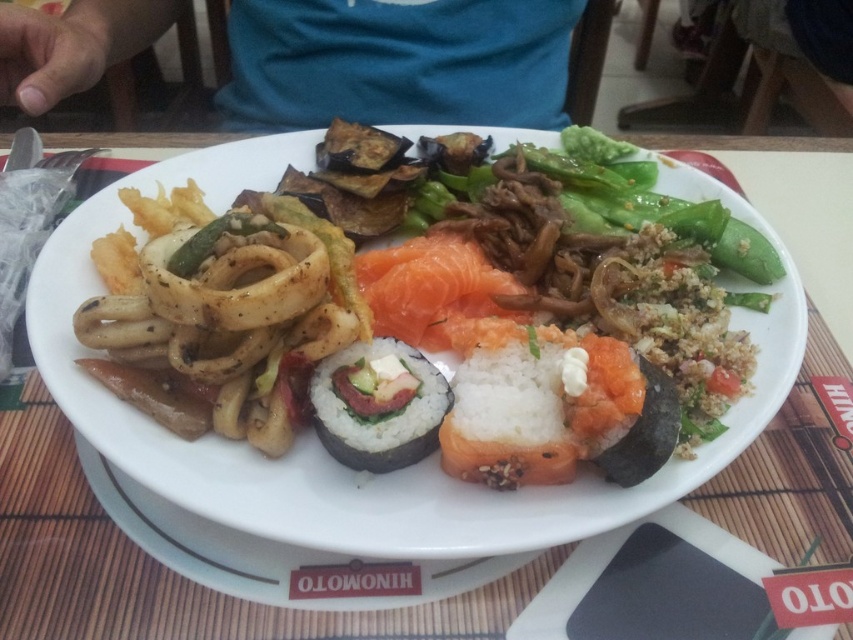
You are a food critic evaluating the arrangement of the sushi at center and the pink raw salmon at center on the plate. Based on their positions, which one is closer to the edge of the plate?

The sushi at center is closer to the edge of the plate because it is positioned in front of the pink raw salmon at center, indicating it is nearer to the viewer and thus closer to the plate edge.

You are a food photographer holding a camera 12 inches away from the white glossy plate at center. Can you capture the entire plate in your photo without moving the camera?

The distance between the white glossy plate at center and the camera is 18.42 inches. Since you are holding the camera only 12 inches away, you are closer than the required distance. To capture the entire plate, you need to move the camera back to at least 18.42 inches away.

You are a food critic who needs to take a closeup photo of the sushi at center and the white glossy plate at center. Your camera has a focus range of 15 centimeters. Can you focus on both objects at the same time?

The white glossy plate at center is 17.11 centimeters from the sushi at center. Since the distance between them is greater than the camera focus range of 15 centimeters, you cannot focus on both objects simultaneously.